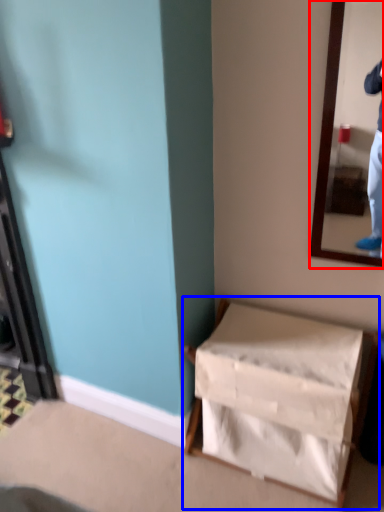
Question: Which object is closer to the camera taking this photo, mirror (highlighted by a red box) or furniture (highlighted by a blue box)?

Choices:
 (A) mirror
 (B) furniture

Answer: (A)